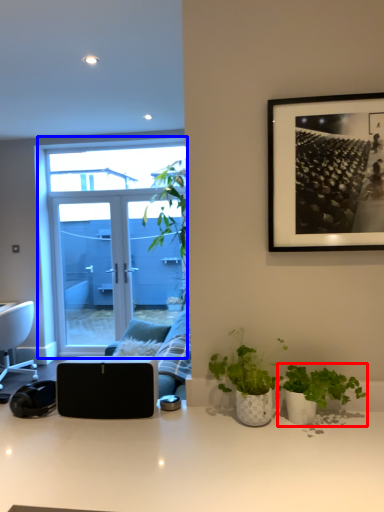
Question: Which of the following is the closest to the observer, houseplant (highlighted by a red box) or window (highlighted by a blue box)?

Choices:
 (A) houseplant
 (B) window

Answer: (A)